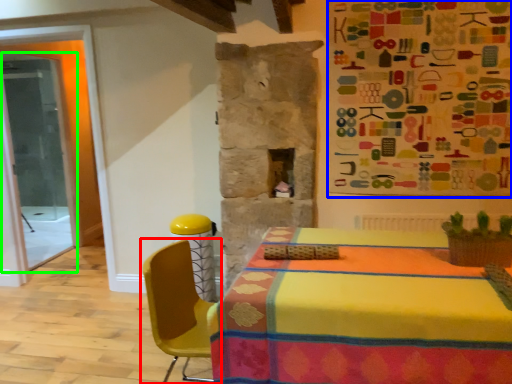
Question: Which object is positioned closest to chair (highlighted by a red box)? Select from bulletin board (highlighted by a blue box) and glass door (highlighted by a green box).

Choices:
 (A) bulletin board
 (B) glass door

Answer: (A)